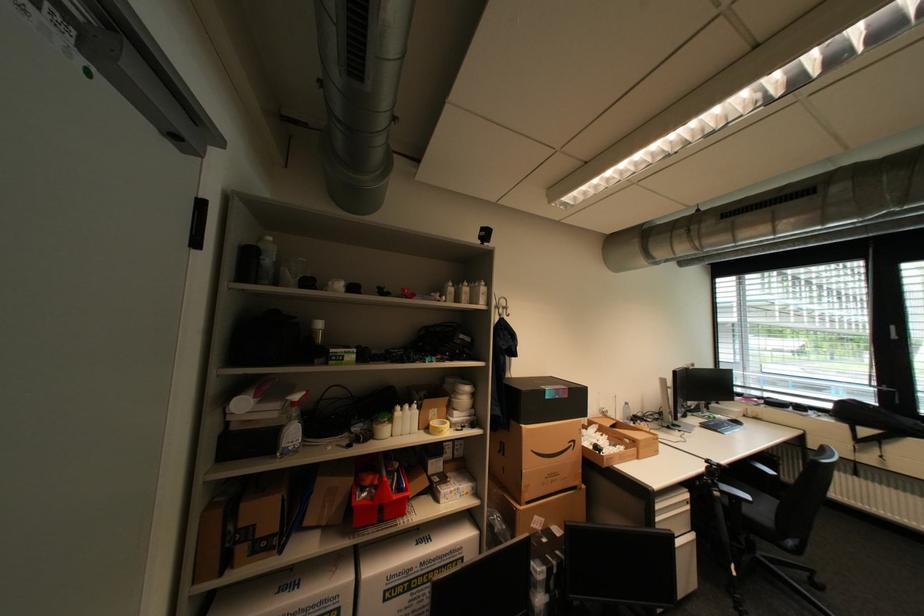
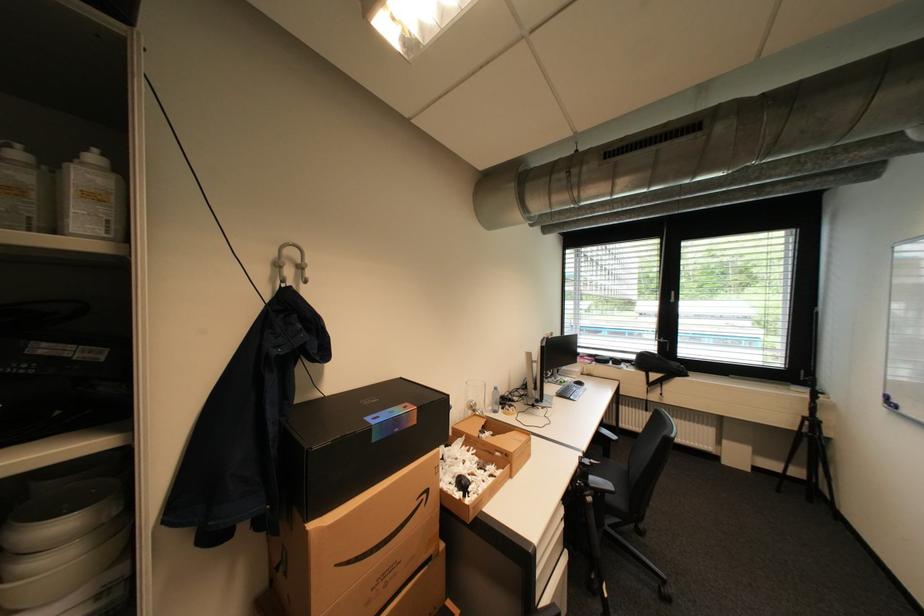
Where in the second image is the point corresponding to point 719,482 from the first image?

(591, 485)